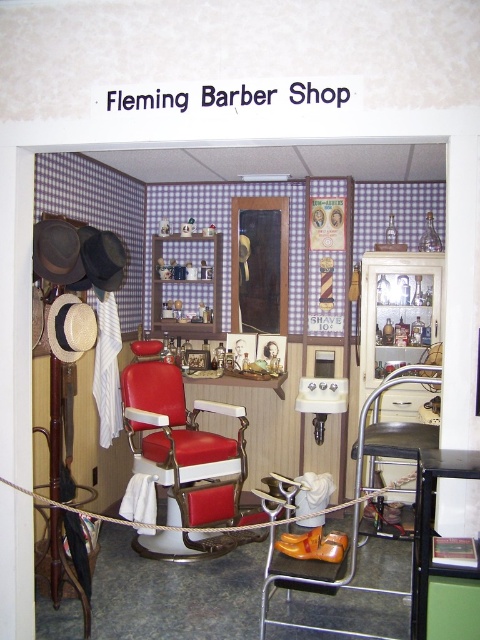
You are a customer entering Fleming Barber Shop and need to choose between the matte red barber chair at center and the black leather stool at center for your haircut. Based on their height, which one would you recommend for someone who prefers a more elevated seating position?

The matte red barber chair at center is taller than the black leather stool at center, so it would be the better choice for someone who prefers a more elevated seating position.

You are a customer entering Fleming Barber Shop and need to choose between the matte red barber chair at center and the black leather stool at center for your haircut. Which one is more likely to be the actual barber chair used for haircuts?

The matte red barber chair at center is more likely to be the actual barber chair used for haircuts because it has a smaller size compared to the black leather stool at center, which is typically a different type of seating.